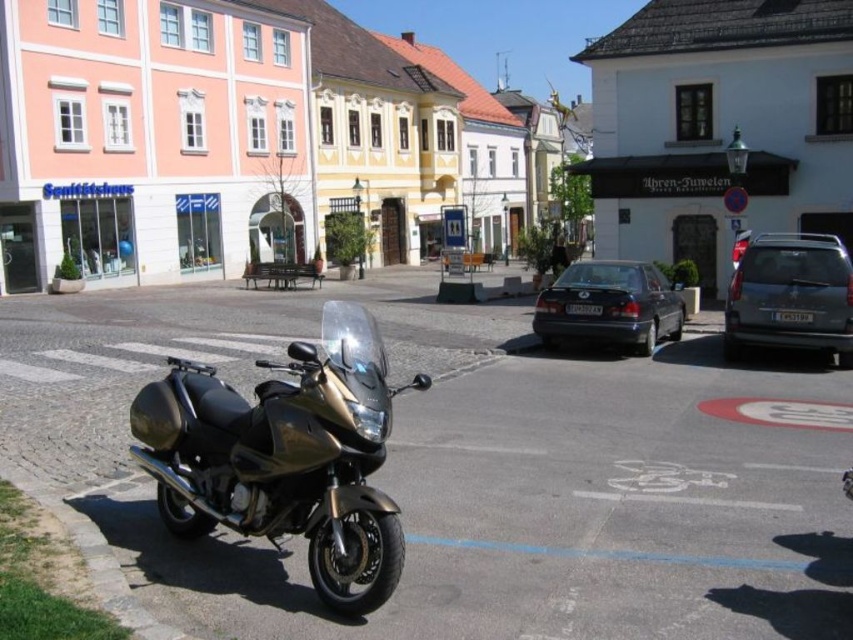
Between point (608, 138) and point (550, 298), which one is positioned behind?

Point (608, 138)

Is matte gold motorcycle at lower left shorter than matte black sedan at center?

In fact, matte gold motorcycle at lower left may be taller than matte black sedan at center.

Describe the element at coordinates (236, 140) in the screenshot. I see `matte gold motorcycle at lower left` at that location.

Locate an element on the screen. matte gold motorcycle at lower left is located at coordinates (236, 140).

Is metallic gold motorcycle at center positioned behind metallic gray van at right?

No, metallic gold motorcycle at center is closer to the viewer.

Can you confirm if metallic gold motorcycle at center is wider than metallic gray van at right?

Indeed, metallic gold motorcycle at center has a greater width compared to metallic gray van at right.

Between point (297, 420) and point (846, 332), which one is positioned in front?

Point (297, 420) is more forward.

Where is `metallic gold motorcycle at center`? metallic gold motorcycle at center is located at coordinates (285, 456).

Which is above, matte gold motorcycle at lower left or metallic gold motorcycle at center?

matte gold motorcycle at lower left is above.

Is matte gold motorcycle at lower left shorter than metallic gold motorcycle at center?

No, matte gold motorcycle at lower left is not shorter than metallic gold motorcycle at center.

Who is more distant from viewer, (289, 163) or (271, 440)?

Positioned behind is point (289, 163).

The height and width of the screenshot is (640, 853). In order to click on matte gold motorcycle at lower left in this screenshot , I will do click(x=236, y=140).